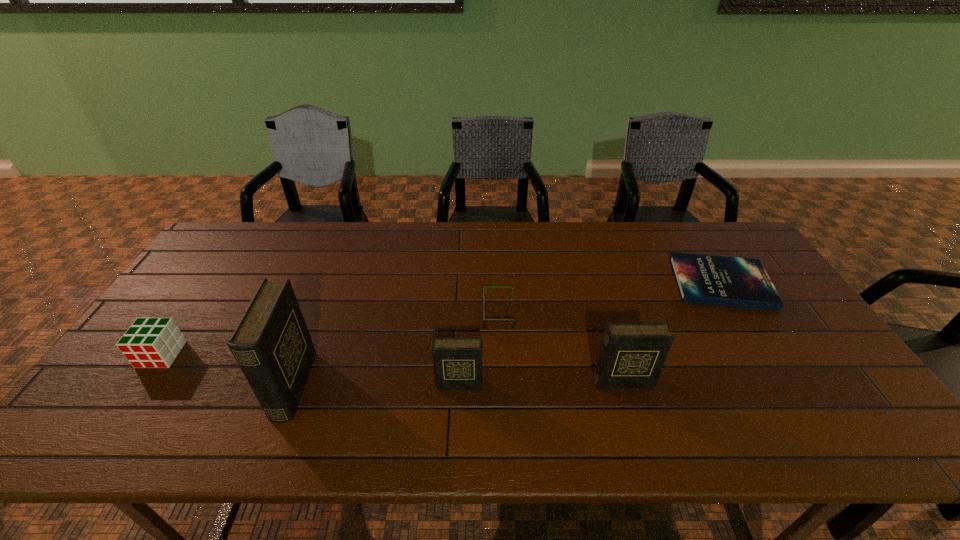
Please point a spot on the right to add another diary. Please provide its 2D coordinates. Your answer should be formatted as a tuple, i.e. [(x, y)], where the tuple contains the x and y coordinates of a point satisfying the conditions above.

[(784, 379)]